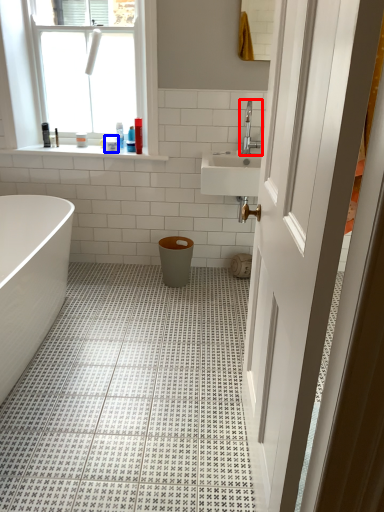
Question: Which object appears farthest to the camera in this image, tap (highlighted by a red box) or toiletry (highlighted by a blue box)?

Choices:
 (A) tap
 (B) toiletry

Answer: (B)